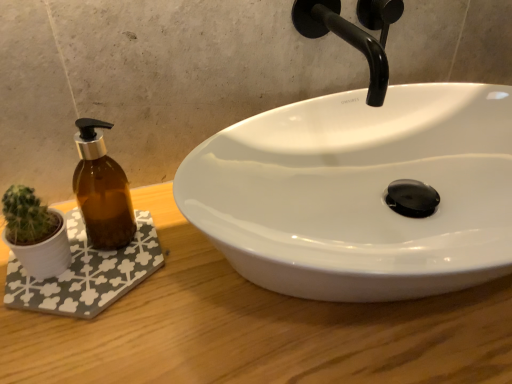
What is the approximate height of white fabric bath mat at lower left?

white fabric bath mat at lower left is 0.54 inches in height.

Measure the distance between point (60, 279) and camera.

18.98 inches.

The image size is (512, 384). What do you see at coordinates (254, 328) in the screenshot?
I see `wooden counter at center` at bounding box center [254, 328].

At what (x,y) coordinates should I click in order to perform the action: click on white glossy sink at center. Please return your answer as a coordinate pair (x, y). This screenshot has width=512, height=384. Looking at the image, I should click on (360, 191).

Identify the location of white fabric bath mat at lower left. The image size is (512, 384). (87, 273).

The width and height of the screenshot is (512, 384). Find the location of `counter top below the white glossy sink at center (from the image's perspective)`. counter top below the white glossy sink at center (from the image's perspective) is located at coordinates (254, 328).

Is point (482, 150) in front of point (159, 371)?

No, (482, 150) is further to viewer.

How different are the orientations of white glossy sink at center and wooden counter at center in degrees?

white glossy sink at center and wooden counter at center are facing 1.04 degrees away from each other.

Which of these two, white glossy sink at center or wooden counter at center, is smaller?

white glossy sink at center is smaller.

Are white fabric bath mat at lower left and black matte faucet at upper center located far from each other?

No, white fabric bath mat at lower left is not far away from black matte faucet at upper center.

From the picture: Is white fabric bath mat at lower left taller than black matte faucet at upper center?

No, white fabric bath mat at lower left is not taller than black matte faucet at upper center.

Locate an element on the screen. This screenshot has width=512, height=384. bath mat located underneath the black matte faucet at upper center (from a real-world perspective) is located at coordinates (87, 273).

Does wooden counter at center have a lesser height compared to white fabric bath mat at lower left?

No, wooden counter at center is not shorter than white fabric bath mat at lower left.

Between wooden counter at center and white fabric bath mat at lower left, which one has smaller width?

With smaller width is white fabric bath mat at lower left.

Based on the photo, between wooden counter at center and white fabric bath mat at lower left, which one has larger size?

wooden counter at center.

Could you tell me if black matte faucet at upper center is turned towards white glossy sink at center?

No, black matte faucet at upper center is not oriented towards white glossy sink at center.

Is black matte faucet at upper center placed right next to white glossy sink at center?

No, black matte faucet at upper center is not in contact with white glossy sink at center.

Which is less distant, (371,52) or (222,152)?

Clearly, point (371,52) is more distant from the camera than point (222,152).

Consider the image. Between black matte faucet at upper center and white glossy sink at center, which one has smaller size?

Smaller between the two is black matte faucet at upper center.

There is a wooden counter at center. Where is `bath mat above it (from a real-world perspective)`? The image size is (512, 384). bath mat above it (from a real-world perspective) is located at coordinates (87, 273).

Are white fabric bath mat at lower left and wooden counter at center beside each other?

No, white fabric bath mat at lower left is not touching wooden counter at center.

Between white fabric bath mat at lower left and wooden counter at center, which one appears on the right side from the viewer's perspective?

Positioned to the right is wooden counter at center.

From the image's perspective, is wooden counter at center above white glossy sink at center?

Actually, wooden counter at center appears below white glossy sink at center in the image.

Is point (45, 319) farther from viewer compared to point (442, 163)?

No, it is in front of (442, 163).

Locate an element on the screen. The width and height of the screenshot is (512, 384). counter top that appears below the white glossy sink at center (from a real-world perspective) is located at coordinates (254, 328).

From the picture: Would you say wooden counter at center is outside white glossy sink at center?

Absolutely, wooden counter at center is external to white glossy sink at center.

Considering the positions of objects white fabric bath mat at lower left and white glossy sink at center in the image provided, who is behind, white fabric bath mat at lower left or white glossy sink at center?

white fabric bath mat at lower left is more distant.

Is point (80, 249) less distant than point (400, 89)?

Yes, point (80, 249) is in front of point (400, 89).

Is white fabric bath mat at lower left to the right of white glossy sink at center from the viewer's perspective?

No, white fabric bath mat at lower left is not to the right of white glossy sink at center.

Where is `counter top on the right of the white glossy sink at center`? This screenshot has width=512, height=384. counter top on the right of the white glossy sink at center is located at coordinates (254, 328).

Where is `tap above the white fabric bath mat at lower left (from a real-world perspective)`? tap above the white fabric bath mat at lower left (from a real-world perspective) is located at coordinates (344, 39).

Based on their spatial positions, is wooden counter at center or white fabric bath mat at lower left closer to black matte faucet at upper center?

wooden counter at center is closer to black matte faucet at upper center.

Based on their spatial positions, is white glossy sink at center or black matte faucet at upper center further from white fabric bath mat at lower left?

black matte faucet at upper center is positioned further to the anchor white fabric bath mat at lower left.

Which object lies nearer to the anchor point wooden counter at center, white glossy sink at center or black matte faucet at upper center?

white glossy sink at center is positioned closer to the anchor wooden counter at center.

Which object lies further to the anchor point wooden counter at center, black matte faucet at upper center or white glossy sink at center?

black matte faucet at upper center is positioned further to the anchor wooden counter at center.

Considering their positions, is white fabric bath mat at lower left positioned further to black matte faucet at upper center than white glossy sink at center?

Among the two, white fabric bath mat at lower left is located further to black matte faucet at upper center.

Considering their positions, is black matte faucet at upper center positioned further to white fabric bath mat at lower left than wooden counter at center?

Among the two, black matte faucet at upper center is located further to white fabric bath mat at lower left.

Consider the image. Estimate the real-world distances between objects in this image. Which object is further from white fabric bath mat at lower left, wooden counter at center or white glossy sink at center?

Based on the image, white glossy sink at center appears to be further to white fabric bath mat at lower left.

Which object lies further to the anchor point wooden counter at center, black matte faucet at upper center or white fabric bath mat at lower left?

Among the two, black matte faucet at upper center is located further to wooden counter at center.

This screenshot has height=384, width=512. Find the location of `sink between white fabric bath mat at lower left and wooden counter at center from left to right`. sink between white fabric bath mat at lower left and wooden counter at center from left to right is located at coordinates (360, 191).

This screenshot has width=512, height=384. I want to click on tap situated between white fabric bath mat at lower left and white glossy sink at center from left to right, so click(x=344, y=39).

At what (x,y) coordinates should I click in order to perform the action: click on sink between black matte faucet at upper center and wooden counter at center from top to bottom. Please return your answer as a coordinate pair (x, y). The height and width of the screenshot is (384, 512). Looking at the image, I should click on (360, 191).

Find the location of a particular element. This screenshot has width=512, height=384. bath mat between black matte faucet at upper center and wooden counter at center in the vertical direction is located at coordinates (87, 273).